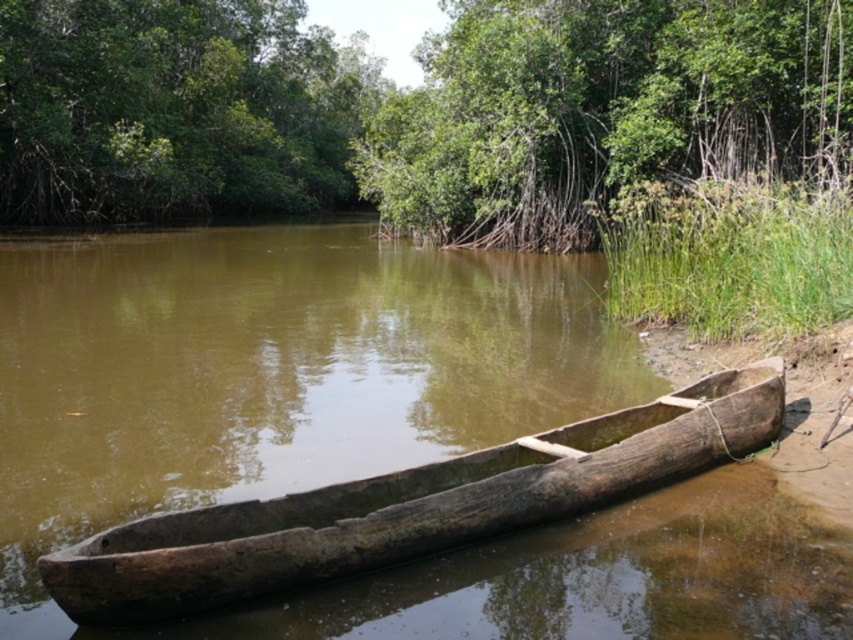
You are standing at the edge of the water and want to look at the green leafy tree at upper center. Which direction should you look relative to the dark brown wood canoe at center?

The green leafy tree at upper center is located above the dark brown wood canoe at center, so you should look upwards from the canoe to see it.

Based on the photo, you are standing at the point labeled as point (601, 109) in the image. What object is directly in front of you?

The point (601, 109) indicates a green leafy tree at upper center, so the object directly in front of you is the green leafy tree at upper center.